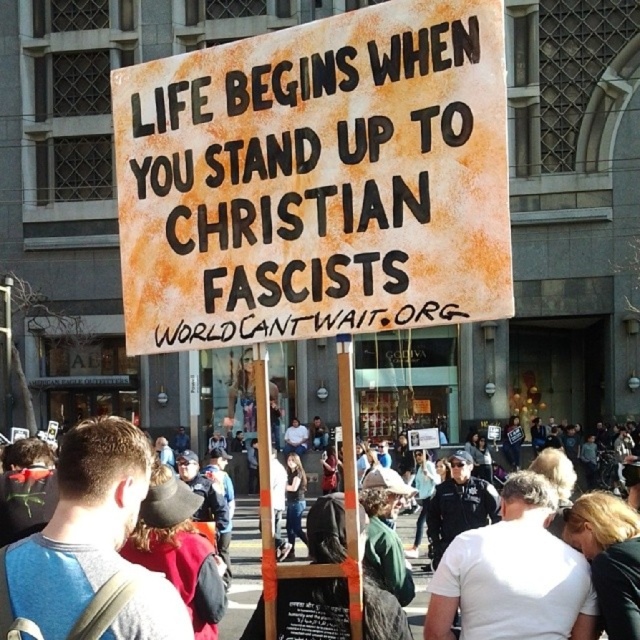
Question: Is rusty cardboard sign at center bigger than white cotton shirt at center?

Choices:
 (A) yes
 (B) no

Answer: (B)

Question: Among these points, which one is farthest from the camera?

Choices:
 (A) click(x=147, y=442)
 (B) click(x=419, y=202)

Answer: (B)

Question: Which of the following is the closest to the observer?

Choices:
 (A) rusty cardboard sign at center
 (B) white cotton shirt at center

Answer: (B)

Question: Which point is closer to the camera taking this photo?

Choices:
 (A) [x=298, y=120]
 (B) [x=93, y=586]

Answer: (B)

Question: Is rusty cardboard sign at center positioned in front of white cotton shirt at center?

Choices:
 (A) no
 (B) yes

Answer: (A)

Question: Is rusty cardboard sign at center positioned behind white cotton shirt at center?

Choices:
 (A) yes
 (B) no

Answer: (A)